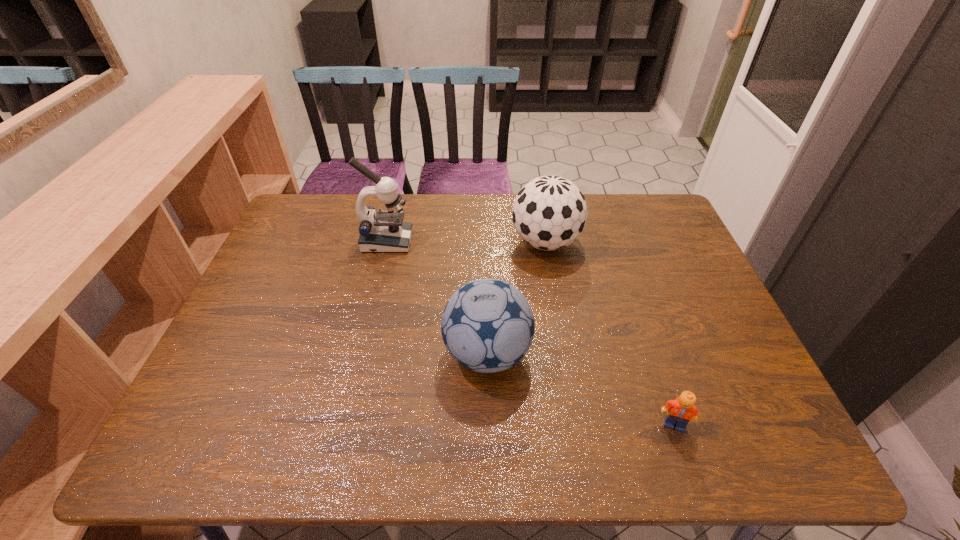
This screenshot has height=540, width=960. Identify the location of vacant space that satisfies the following two spatial constraints: 1. at the eyepiece of the farther soccer ball; 2. on the left side of the leftmost object. (387, 242).

Identify the location of free space that satisfies the following two spatial constraints: 1. at the eyepiece of the microscope; 2. on the right side of the farther soccer ball. This screenshot has height=540, width=960. (387, 242).